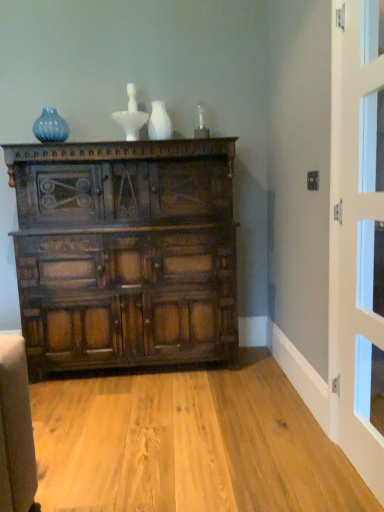
At what (x,y) coordinates should I click in order to perform the action: click on vacant area in front of dark brown wood chest of drawers at center. Please return your answer as a coordinate pair (x, y). Looking at the image, I should click on (148, 426).